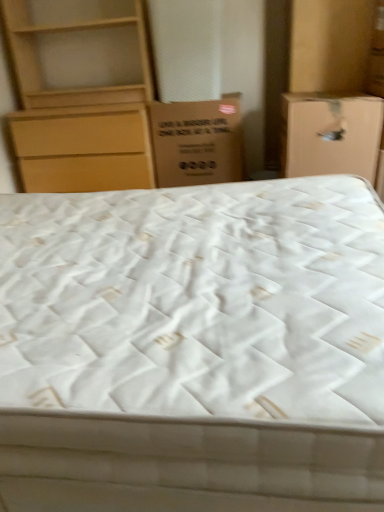
Question: Considering the relative sizes of matte cardboard box at right, the 1th cardboard box viewed from the right, and matte wood chest of drawers at upper left in the image provided, is matte cardboard box at right, the 1th cardboard box viewed from the right, smaller than matte wood chest of drawers at upper left?

Choices:
 (A) no
 (B) yes

Answer: (B)

Question: Does matte cardboard box at right, which is the second cardboard box in left-to-right order, come behind matte wood chest of drawers at upper left?

Choices:
 (A) yes
 (B) no

Answer: (B)

Question: Is matte wood chest of drawers at upper left at the back of matte cardboard box at right, the 1th cardboard box viewed from the right?

Choices:
 (A) yes
 (B) no

Answer: (B)

Question: Is matte cardboard box at right, the 1th cardboard box viewed from the right, not close to matte wood chest of drawers at upper left?

Choices:
 (A) no
 (B) yes

Answer: (B)

Question: Does matte cardboard box at right, the 1th cardboard box viewed from the right, turn towards matte wood chest of drawers at upper left?

Choices:
 (A) no
 (B) yes

Answer: (A)

Question: In the image, is matte cardboard box at right, the 1th cardboard box viewed from the right, positioned in front of or behind matte wood chest of drawers at upper left?

Choices:
 (A) front
 (B) behind

Answer: (A)

Question: Based on their sizes in the image, would you say matte cardboard box at right, which is the second cardboard box in left-to-right order, is bigger or smaller than matte wood chest of drawers at upper left?

Choices:
 (A) big
 (B) small

Answer: (B)

Question: From a real-world perspective, is matte cardboard box at right, the 1th cardboard box viewed from the right, physically located above or below matte wood chest of drawers at upper left?

Choices:
 (A) below
 (B) above

Answer: (A)

Question: Is matte cardboard box at right, the 1th cardboard box viewed from the right, taller or shorter than matte wood chest of drawers at upper left?

Choices:
 (A) short
 (B) tall

Answer: (A)

Question: Is matte wood chest of drawers at upper left taller or shorter than brown cardboard box at center, which is the second cardboard box from right to left?

Choices:
 (A) short
 (B) tall

Answer: (B)

Question: Looking at the image, does matte wood chest of drawers at upper left seem bigger or smaller compared to brown cardboard box at center, which is the second cardboard box from right to left?

Choices:
 (A) small
 (B) big

Answer: (B)

Question: From a real-world perspective, is matte wood chest of drawers at upper left positioned above or below brown cardboard box at center, which is the second cardboard box from right to left?

Choices:
 (A) below
 (B) above

Answer: (B)

Question: Is matte wood chest of drawers at upper left in front of or behind brown cardboard box at center, which appears as the 1th cardboard box when viewed from the left, in the image?

Choices:
 (A) front
 (B) behind

Answer: (A)

Question: In the image, is matte wood chest of drawers at upper left on the left side or the right side of matte cardboard box at right, the 1th cardboard box viewed from the right?

Choices:
 (A) left
 (B) right

Answer: (A)

Question: Is matte wood chest of drawers at upper left in front of or behind matte cardboard box at right, the 1th cardboard box viewed from the right, in the image?

Choices:
 (A) behind
 (B) front

Answer: (A)